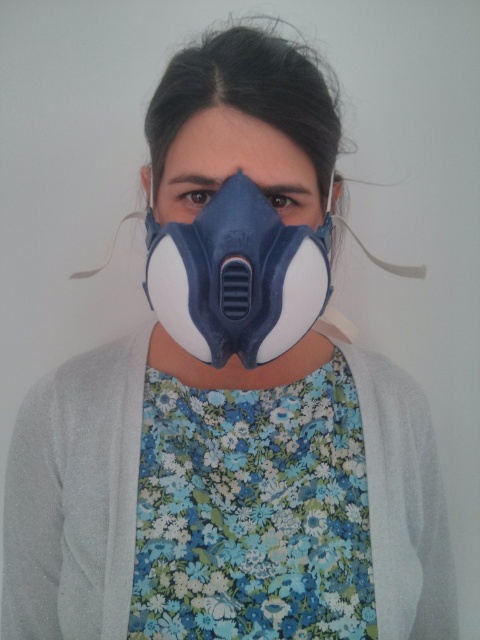
Is matte blue/white mask at center above matte blue respirator at center?

No.

The height and width of the screenshot is (640, 480). Identify the location of matte blue/white mask at center. (237, 276).

The width and height of the screenshot is (480, 640). Identify the location of matte blue/white mask at center. (237, 276).

Find the location of a particular element. matte blue/white mask at center is located at coordinates (237, 276).